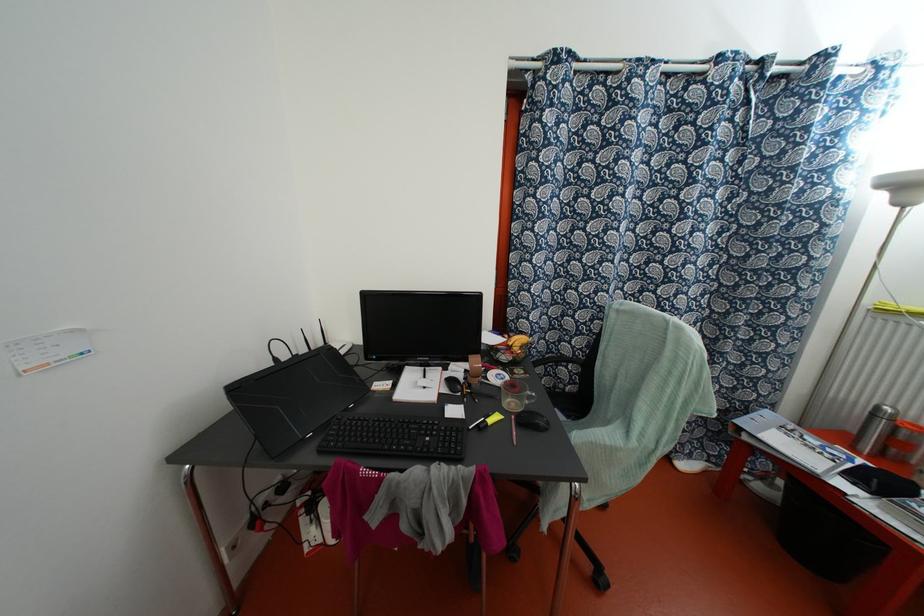
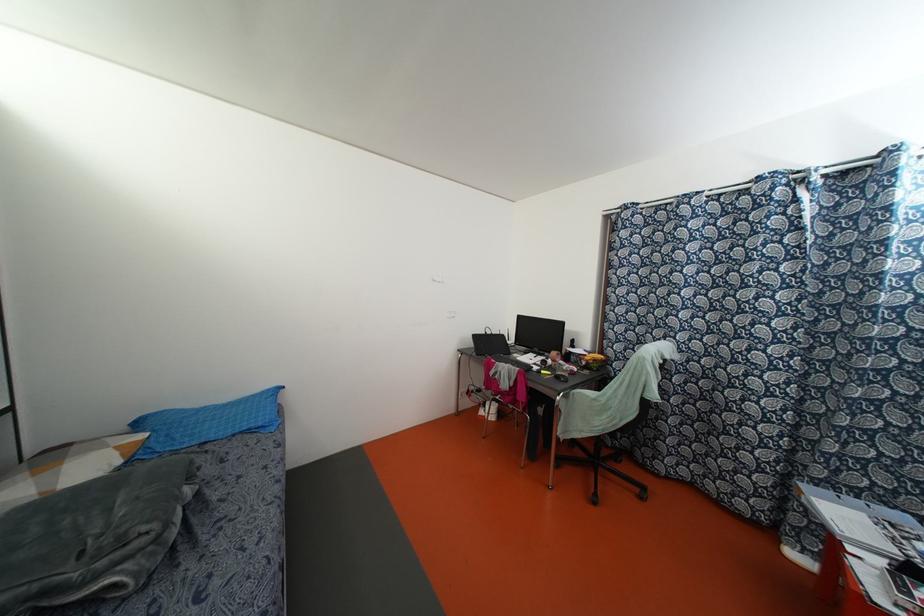
The point at (x=520, y=346) is marked in the first image. Where is the corresponding point in the second image?

(593, 360)